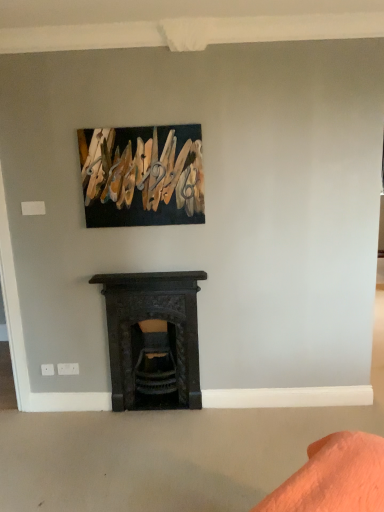
Measure the distance between point (117, 395) and camera.

Point (117, 395) is 2.96 meters from camera.

What do you see at coordinates (153, 338) in the screenshot?
I see `dark gray stone fireplace at center` at bounding box center [153, 338].

Locate an element on the screen. This screenshot has height=512, width=384. dark gray stone fireplace at center is located at coordinates (153, 338).

The height and width of the screenshot is (512, 384). Describe the element at coordinates (142, 175) in the screenshot. I see `wooden clothespins at upper center` at that location.

The height and width of the screenshot is (512, 384). Identify the location of wooden clothespins at upper center. (142, 175).

The height and width of the screenshot is (512, 384). I want to click on dark gray stone fireplace at center, so click(x=153, y=338).

Based on their positions, is wooden clothespins at upper center located to the left or right of dark gray stone fireplace at center?

In the image, wooden clothespins at upper center appears on the left side of dark gray stone fireplace at center.

Does wooden clothespins at upper center come in front of dark gray stone fireplace at center?

Yes, the depth of wooden clothespins at upper center is less than that of dark gray stone fireplace at center.

Is point (162, 178) farther from viewer compared to point (196, 367)?

No.

From the image's perspective, is wooden clothespins at upper center on top of dark gray stone fireplace at center?

Yes, from the image's perspective, wooden clothespins at upper center is over dark gray stone fireplace at center.

From a real-world perspective, between wooden clothespins at upper center and dark gray stone fireplace at center, who is vertically higher?

wooden clothespins at upper center is physically above.

Can you confirm if wooden clothespins at upper center is wider than dark gray stone fireplace at center?

No.

Which of these two, wooden clothespins at upper center or dark gray stone fireplace at center, stands shorter?

Standing shorter between the two is wooden clothespins at upper center.

Does wooden clothespins at upper center have a smaller size compared to dark gray stone fireplace at center?

Correct, wooden clothespins at upper center occupies less space than dark gray stone fireplace at center.

Is wooden clothespins at upper center outside of dark gray stone fireplace at center?

wooden clothespins at upper center lies outside dark gray stone fireplace at center's area.

Is wooden clothespins at upper center not close to dark gray stone fireplace at center?

That's not correct — wooden clothespins at upper center is a little close to dark gray stone fireplace at center.

Does wooden clothespins at upper center turn towards dark gray stone fireplace at center?

No, wooden clothespins at upper center is not facing towards dark gray stone fireplace at center.

Can you tell me how much wooden clothespins at upper center and dark gray stone fireplace at center differ in facing direction?

0.00391 degrees separate the facing orientations of wooden clothespins at upper center and dark gray stone fireplace at center.

Find the location of a particular element. This screenshot has width=384, height=512. fireplace located behind the wooden clothespins at upper center is located at coordinates click(x=153, y=338).

Is dark gray stone fireplace at center at the right side of wooden clothespins at upper center?

Yes, dark gray stone fireplace at center is to the right of wooden clothespins at upper center.

Considering their positions, is dark gray stone fireplace at center located in front of or behind wooden clothespins at upper center?

Visually, dark gray stone fireplace at center is located behind wooden clothespins at upper center.

Is point (172, 393) in front of point (154, 127)?

No, it is not.

From the image's perspective, between dark gray stone fireplace at center and wooden clothespins at upper center, which one is located above?

wooden clothespins at upper center is shown above in the image.

From a real-world perspective, between dark gray stone fireplace at center and wooden clothespins at upper center, who is vertically higher?

From a 3D spatial view, wooden clothespins at upper center is above.

Does dark gray stone fireplace at center have a greater width compared to wooden clothespins at upper center?

Correct, the width of dark gray stone fireplace at center exceeds that of wooden clothespins at upper center.

Who is taller, dark gray stone fireplace at center or wooden clothespins at upper center?

dark gray stone fireplace at center is taller.

Considering the sizes of objects dark gray stone fireplace at center and wooden clothespins at upper center in the image provided, who is smaller, dark gray stone fireplace at center or wooden clothespins at upper center?

wooden clothespins at upper center.

Is dark gray stone fireplace at center inside or outside of wooden clothespins at upper center?

dark gray stone fireplace at center exists outside the volume of wooden clothespins at upper center.

Does dark gray stone fireplace at center touch wooden clothespins at upper center?

No, dark gray stone fireplace at center is not in contact with wooden clothespins at upper center.

Could you tell me if dark gray stone fireplace at center is turned towards wooden clothespins at upper center?

No, dark gray stone fireplace at center is not oriented towards wooden clothespins at upper center.

In the image, there is a wooden clothespins at upper center. Where is `fireplace below it (from the image's perspective)`? The height and width of the screenshot is (512, 384). fireplace below it (from the image's perspective) is located at coordinates pyautogui.click(x=153, y=338).

Locate an element on the screen. The image size is (384, 512). picture frame in front of the dark gray stone fireplace at center is located at coordinates (142, 175).

You are a GUI agent. You are given a task and a screenshot of the screen. Output one action in this format:
    pyautogui.click(x=<x>, y=<y>)
    Task: Click on the fireplace below the wooden clothespins at upper center (from the image's perspective)
    This screenshot has width=384, height=512.
    Given the screenshot: What is the action you would take?
    pyautogui.click(x=153, y=338)